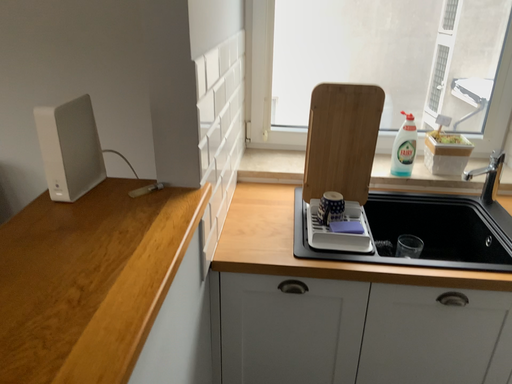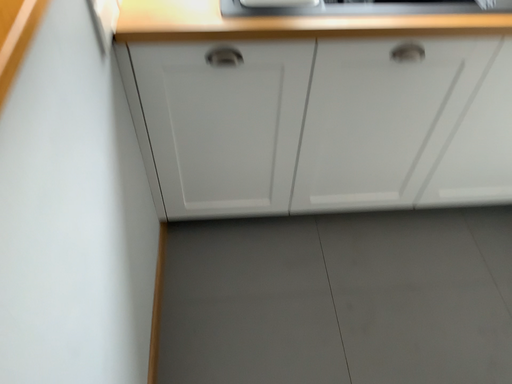
Question: Which way did the camera rotate in the video?

Choices:
 (A) rotated right
 (B) rotated left

Answer: (A)